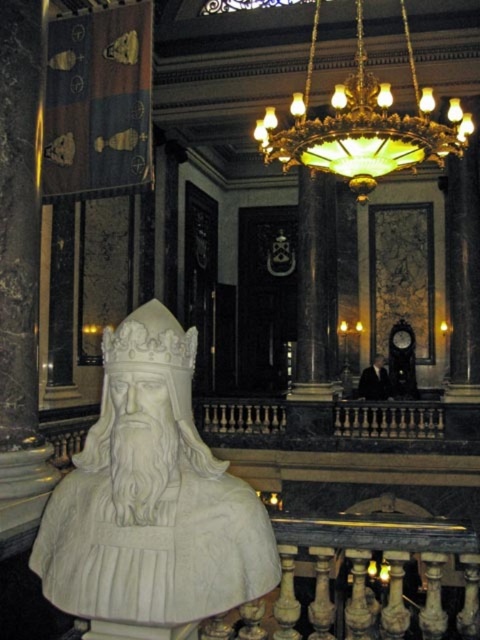
Is white marble bust at center below green stained glass chandelier at upper center?

Yes, white marble bust at center is below green stained glass chandelier at upper center.

Does white marble bust at center have a lesser height compared to green stained glass chandelier at upper center?

Indeed, white marble bust at center has a lesser height compared to green stained glass chandelier at upper center.

Measure the distance between point (276, 560) and camera.

2.14 meters

Find the location of a particular element. This screenshot has width=480, height=640. white marble bust at center is located at coordinates (152, 497).